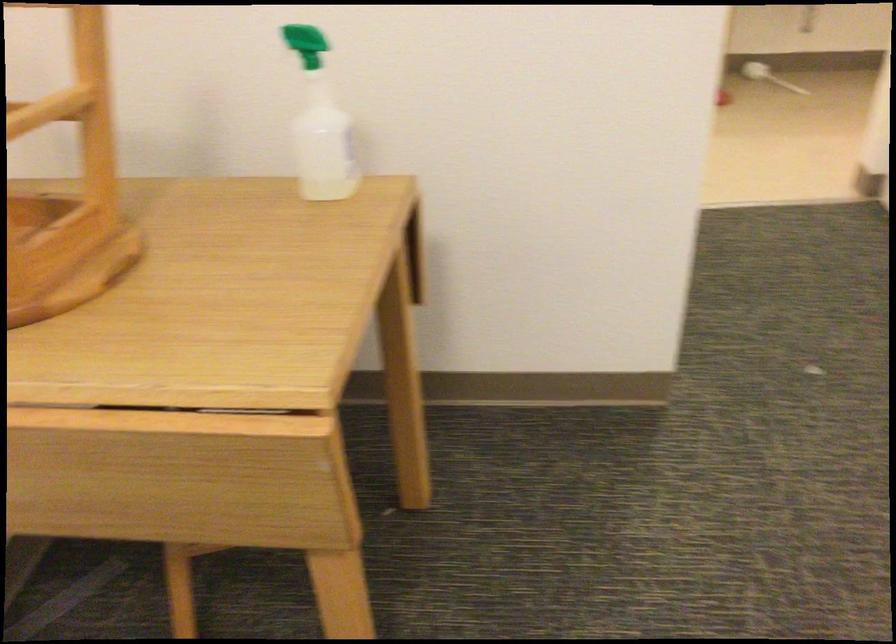
The image size is (896, 644). I want to click on white spray bottle, so click(319, 124).